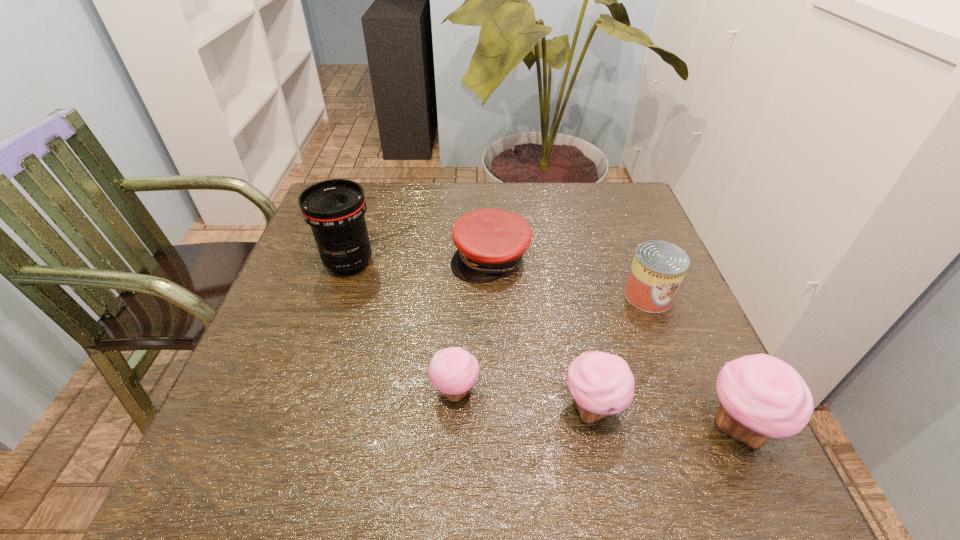
The image size is (960, 540). I want to click on empty location between the tallest object and the cap, so click(420, 260).

I want to click on free spot between the tallest object and the second cupcake from right to left, so click(x=470, y=335).

Locate an element on the screen. This screenshot has height=540, width=960. blank region between the leftmost object and the cap is located at coordinates (420, 260).

Locate an element on the screen. This screenshot has height=540, width=960. free spot between the shortest cupcake and the telephoto lens is located at coordinates (402, 327).

I want to click on object that stands as the third closest to the leftmost cupcake, so click(x=335, y=208).

Identify which object is located as the fourth nearest to the can. Please provide its 2D coordinates. Your answer should be formatted as a tuple, i.e. [(x, y)], where the tuple contains the x and y coordinates of a point satisfying the conditions above.

[(453, 371)]

Identify which cupcake is located as the third nearest to the cap. Please provide its 2D coordinates. Your answer should be formatted as a tuple, i.e. [(x, y)], where the tuple contains the x and y coordinates of a point satisfying the conditions above.

[(762, 397)]

Locate an element on the screen. the closest cupcake relative to the tallest cupcake is located at coordinates (602, 384).

Where is `free space that satisfies the following two spatial constraints: 1. on the front side of the telephoto lens; 2. on the right side of the rightmost cupcake`? This screenshot has height=540, width=960. free space that satisfies the following two spatial constraints: 1. on the front side of the telephoto lens; 2. on the right side of the rightmost cupcake is located at coordinates (295, 427).

Find the location of a particular element. The width and height of the screenshot is (960, 540). vacant space that satisfies the following two spatial constraints: 1. on the front side of the rightmost cupcake; 2. on the right side of the can is located at coordinates (700, 427).